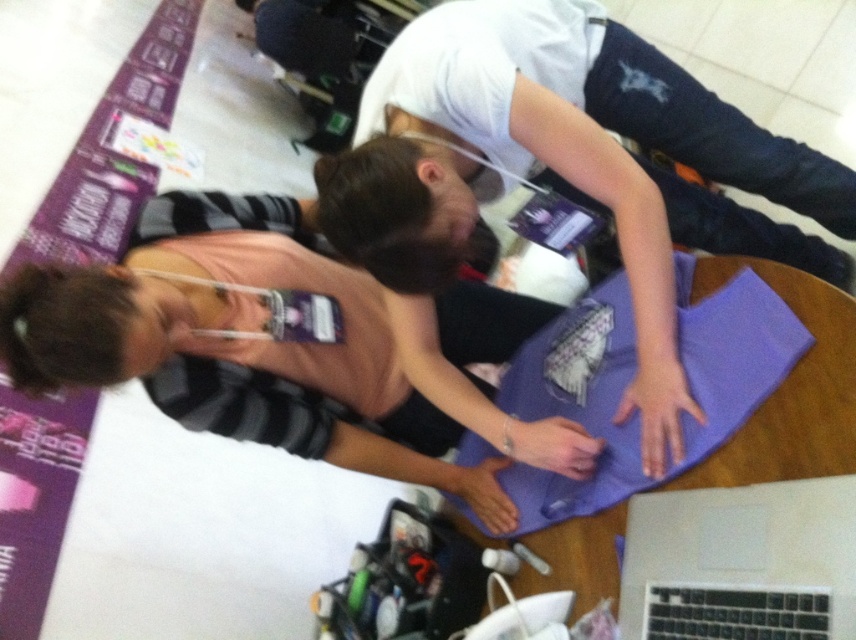
Who is positioned more to the left, pink fabric at center or purple fabric at center?

From the viewer's perspective, pink fabric at center appears more on the left side.

Is point (158, 257) positioned behind point (682, 328)?

Yes, it is behind point (682, 328).

What do you see at coordinates (280, 353) in the screenshot? The width and height of the screenshot is (856, 640). I see `pink fabric at center` at bounding box center [280, 353].

Locate an element on the screen. Image resolution: width=856 pixels, height=640 pixels. pink fabric at center is located at coordinates (280, 353).

Between purple fabric at center and silver metallic laptop at lower right, which one appears on the left side from the viewer's perspective?

purple fabric at center

Which is above, purple fabric at center or silver metallic laptop at lower right?

purple fabric at center is above.

Which is behind, point (572, 332) or point (742, 554)?

The point (572, 332) is more distant.

Where is `purple fabric at center`? The width and height of the screenshot is (856, 640). purple fabric at center is located at coordinates (631, 378).

Does pink fabric at center have a lesser height compared to silver metallic laptop at lower right?

Incorrect, pink fabric at center's height does not fall short of silver metallic laptop at lower right's.

Locate an element on the screen. pink fabric at center is located at coordinates (280, 353).

Locate an element on the screen. This screenshot has height=640, width=856. pink fabric at center is located at coordinates (280, 353).